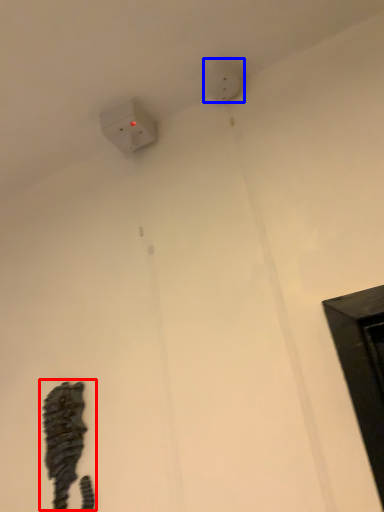
Question: Which of the following is the farthest to the observer, animal (highlighted by a red box) or electric outlet (highlighted by a blue box)?

Choices:
 (A) animal
 (B) electric outlet

Answer: (B)